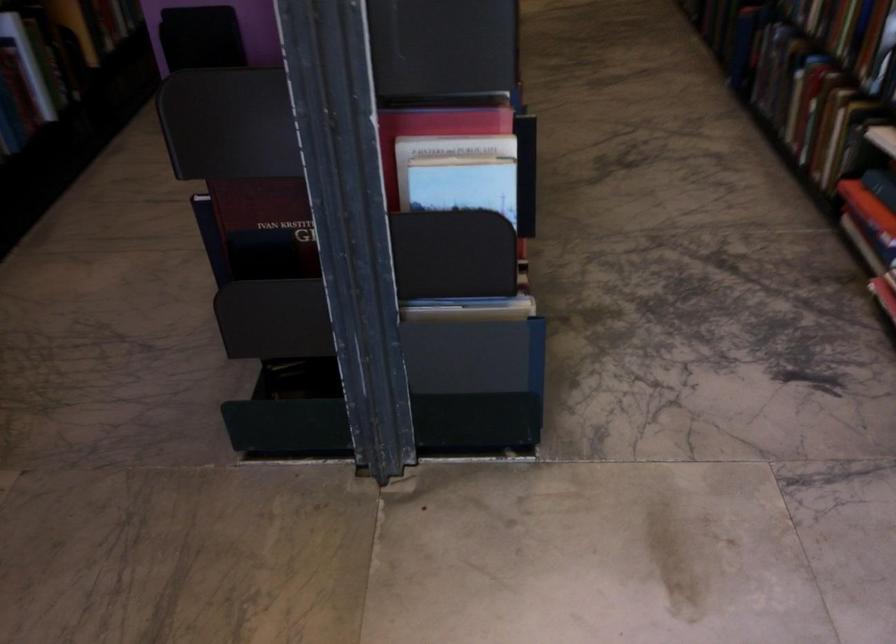
Question: The first image is from the beginning of the video and the second image is from the end. How did the camera likely rotate when shooting the video?

Choices:
 (A) Left
 (B) Right
 (C) Up
 (D) Down

Answer: (B)